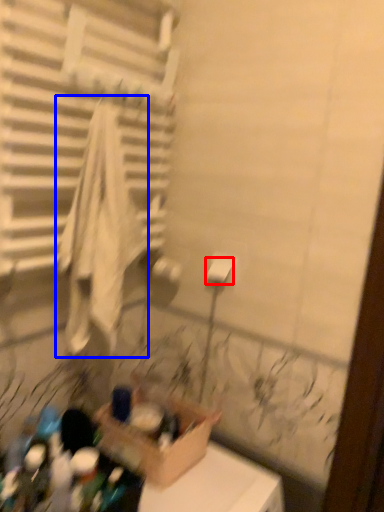
Question: Which of the following is the closest to the observer, toilet paper (highlighted by a red box) or bath towel (highlighted by a blue box)?

Choices:
 (A) toilet paper
 (B) bath towel

Answer: (B)